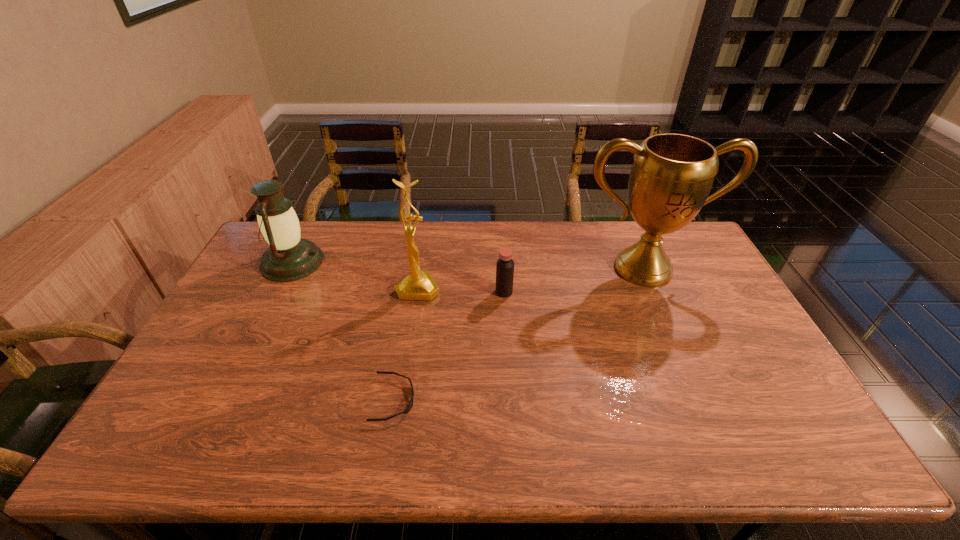
You are a GUI agent. You are given a task and a screenshot of the screen. Output one action in this format:
    pyautogui.click(x=<x>, y=<y>)
    Task: Click on the vacant area that lies between the rightmost object and the vinegar
    
    Given the screenshot: What is the action you would take?
    pyautogui.click(x=573, y=280)

Where is `vacant point located between the lantern and the fourth tallest object`? Image resolution: width=960 pixels, height=540 pixels. vacant point located between the lantern and the fourth tallest object is located at coordinates (398, 277).

Where is `free spot between the sunglasses and the rightmost object`? The height and width of the screenshot is (540, 960). free spot between the sunglasses and the rightmost object is located at coordinates (518, 334).

At what (x,y) coordinates should I click in order to perform the action: click on unoccupied position between the fourth shortest object and the leftmost object. Please return your answer as a coordinate pair (x, y). This screenshot has height=540, width=960. Looking at the image, I should click on [x=355, y=275].

Locate an element on the screen. The height and width of the screenshot is (540, 960). object that is the closest one to the fourth object from left to right is located at coordinates (419, 285).

Select which object is the third closest to the tallest object. Please provide its 2D coordinates. Your answer should be formatted as a tuple, i.e. [(x, y)], where the tuple contains the x and y coordinates of a point satisfying the conditions above.

[(408, 408)]

At what (x,y) coordinates should I click in order to perform the action: click on vacant space that satisfies the following two spatial constraints: 1. on the surface of the tallest object with symbols; 2. on the front-facing side of the shortest object. Please return your answer as a coordinate pair (x, y). The width and height of the screenshot is (960, 540). Looking at the image, I should click on (700, 400).

Find the location of a particular element. The height and width of the screenshot is (540, 960). vacant area in the image that satisfies the following two spatial constraints: 1. on the surface of the trophy cup with symbols; 2. on the front-facing side of the shortest object is located at coordinates (700, 400).

In order to click on vacant space that satisfies the following two spatial constraints: 1. with the light compartment facing forward on the vinegar; 2. on the left side of the third tallest object in this screenshot , I will do click(x=277, y=292).

This screenshot has width=960, height=540. What are the coordinates of `free location that satisfies the following two spatial constraints: 1. on the front side of the vinegar; 2. on the front-facing side of the nearest object` in the screenshot? It's located at (511, 400).